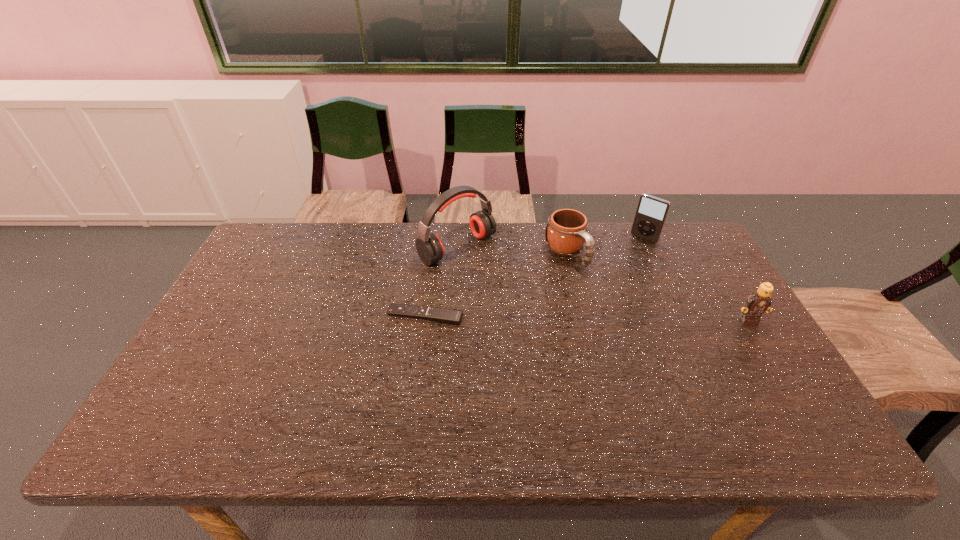
Locate an element on the screen. Image resolution: width=960 pixels, height=540 pixels. vacant space located on the side of the third object from left to right with the handle is located at coordinates (658, 350).

The width and height of the screenshot is (960, 540). What are the coordinates of `vacant space located on the front-facing side of the fourth shortest object` in the screenshot? It's located at (616, 271).

Find the location of a particular element. This screenshot has width=960, height=540. vacant space situated 0.300m on the front-facing side of the fourth shortest object is located at coordinates (599, 292).

Locate an element on the screen. This screenshot has width=960, height=540. vacant space located 0.390m on the front-facing side of the fourth shortest object is located at coordinates (585, 309).

At what (x,y) coordinates should I click in order to perform the action: click on vacant space located on the ear cups of the tallest object. Please return your answer as a coordinate pair (x, y). The height and width of the screenshot is (540, 960). Looking at the image, I should click on (509, 288).

You are a GUI agent. You are given a task and a screenshot of the screen. Output one action in this format:
    pyautogui.click(x=<x>, y=<y>)
    Task: Click on the vacant space located on the ear cups of the tallest object
    
    Given the screenshot: What is the action you would take?
    pyautogui.click(x=500, y=281)

Locate an element on the screen. Image resolution: width=960 pixels, height=540 pixels. vacant space located on the ear cups of the tallest object is located at coordinates (503, 282).

Where is `mug located in the far edge section of the desktop`? The image size is (960, 540). mug located in the far edge section of the desktop is located at coordinates (566, 233).

This screenshot has height=540, width=960. Identify the location of iPod located in the far edge section of the desktop. (651, 213).

Where is `earphone at the far edge`? This screenshot has height=540, width=960. earphone at the far edge is located at coordinates (429, 247).